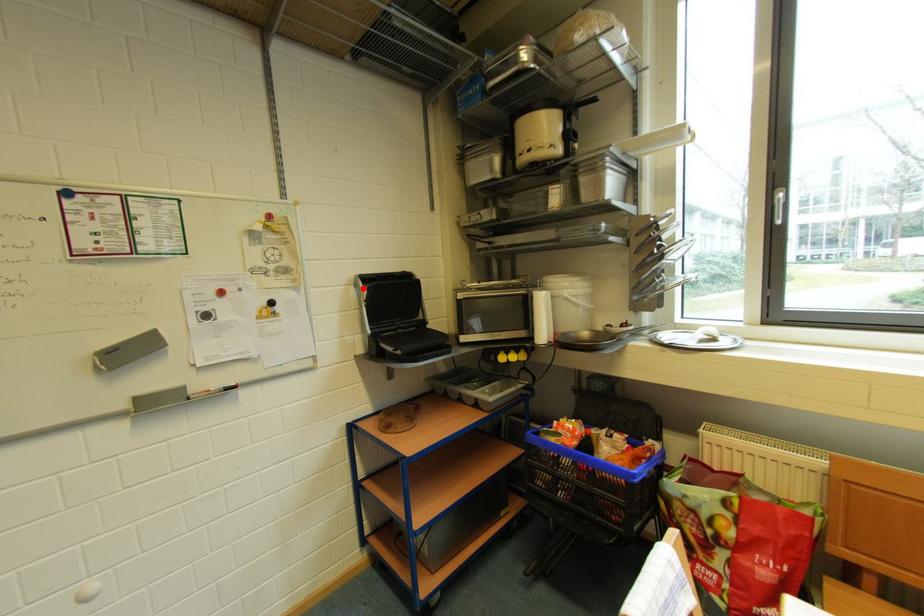
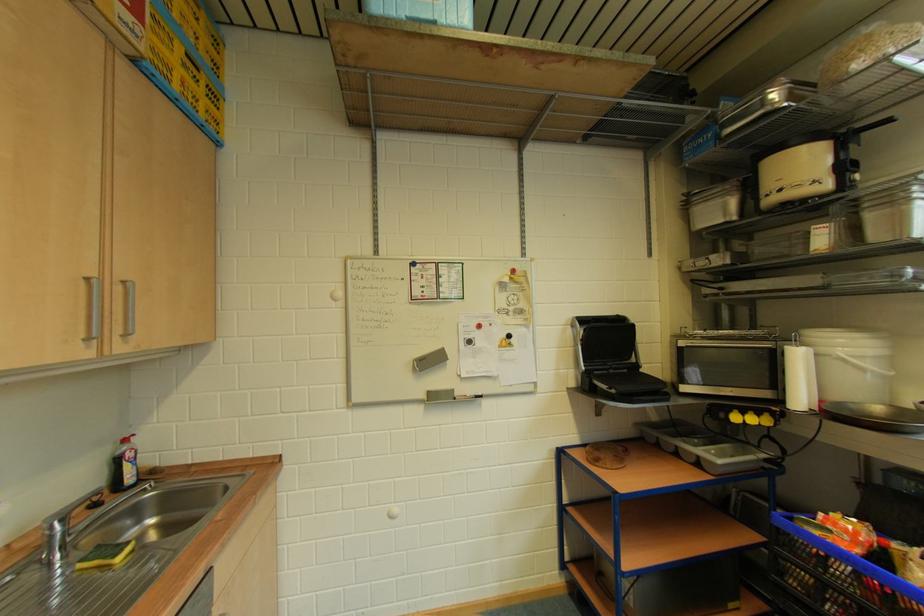
The point at the highlighted location is marked in the first image. Where is the corresponding point in the second image?

(579, 329)